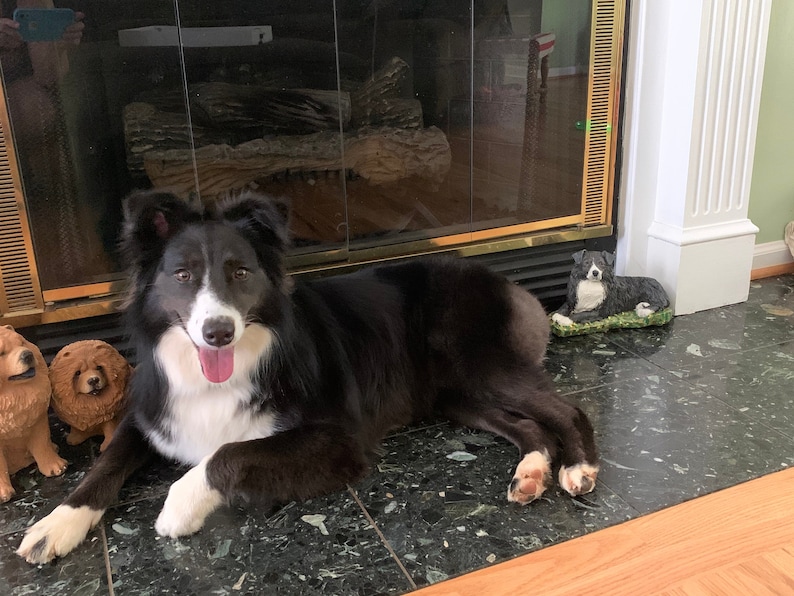
At what (x,y) coordinates should I click in order to perform the action: click on hardwood floor. Please return your answer as a coordinate pair (x, y). The width and height of the screenshot is (794, 596). Looking at the image, I should click on (738, 532), (766, 574).